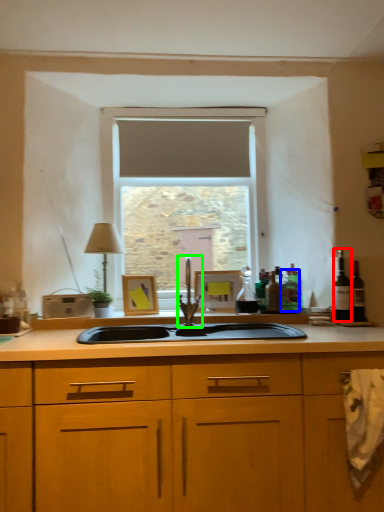
Question: Which is nearer to the wine bottle (highlighted by a red box)? bottle (highlighted by a blue box) or tap (highlighted by a green box).

Choices:
 (A) bottle
 (B) tap

Answer: (A)